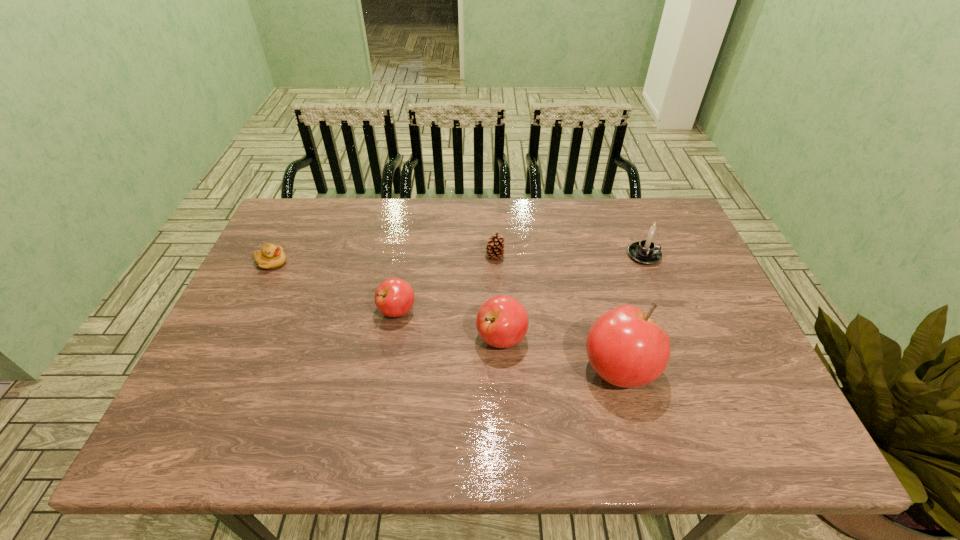
What are the coordinates of `vacant space at the far edge of the desktop` in the screenshot? It's located at (573, 234).

Locate an element on the screen. vacant space at the near edge of the desktop is located at coordinates (381, 400).

At what (x,y) coordinates should I click in order to perform the action: click on vacant space at the left edge. Please return your answer as a coordinate pair (x, y). The width and height of the screenshot is (960, 540). Looking at the image, I should click on (286, 274).

What are the coordinates of `vacant space at the right edge` in the screenshot? It's located at (684, 303).

This screenshot has height=540, width=960. Identify the location of vacant space at the far left corner. (320, 240).

The width and height of the screenshot is (960, 540). In the image, there is a desktop. Find the location of `vacant space at the near left corner`. vacant space at the near left corner is located at coordinates (233, 374).

In the image, there is a desktop. Where is `vacant space at the far right corner`? This screenshot has height=540, width=960. vacant space at the far right corner is located at coordinates (671, 204).

What are the coordinates of `free spot between the shortest apple and the rightmost object` in the screenshot? It's located at (520, 283).

You are a GUI agent. You are given a task and a screenshot of the screen. Output one action in this format:
    pyautogui.click(x=<x>, y=<y>)
    Task: Click on the free space between the rightmost object and the second tallest apple
    
    Given the screenshot: What is the action you would take?
    pyautogui.click(x=573, y=297)

Locate an element on the screen. The width and height of the screenshot is (960, 540). unoccupied area between the duckling and the rightmost object is located at coordinates (458, 259).